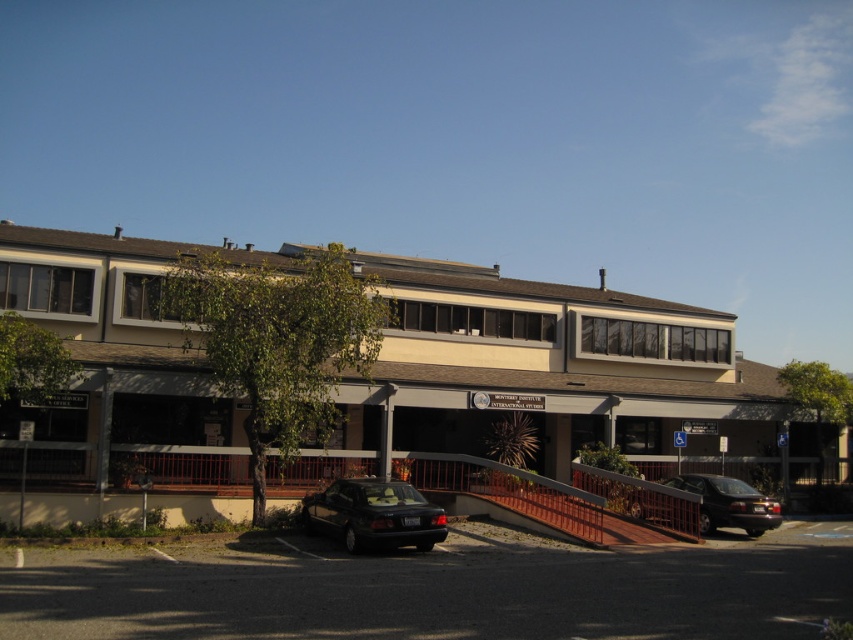
Does point (354, 545) come behind point (724, 513)?

No, (354, 545) is closer to viewer.

Which is in front, point (379, 522) or point (758, 497)?

Point (379, 522) is more forward.

The width and height of the screenshot is (853, 640). Find the location of `shiny black sedan at lower center`. shiny black sedan at lower center is located at coordinates (373, 515).

Between beige/wooden hotel at center and shiny black sedan at lower center, which one appears on the left side from the viewer's perspective?

From the viewer's perspective, shiny black sedan at lower center appears more on the left side.

Between beige/wooden hotel at center and shiny black sedan at lower center, which one is positioned lower?

shiny black sedan at lower center

Identify the location of beige/wooden hotel at center. The width and height of the screenshot is (853, 640). (563, 376).

Image resolution: width=853 pixels, height=640 pixels. In order to click on beige/wooden hotel at center in this screenshot , I will do `click(563, 376)`.

Does beige/wooden hotel at center lie behind shiny black sedan at lower right?

No, it is not.

Does beige/wooden hotel at center have a lesser height compared to shiny black sedan at lower right?

No.

Between point (640, 348) and point (749, 509), which one is positioned behind?

Positioned behind is point (640, 348).

Where is `beige/wooden hotel at center`? This screenshot has width=853, height=640. beige/wooden hotel at center is located at coordinates (563, 376).